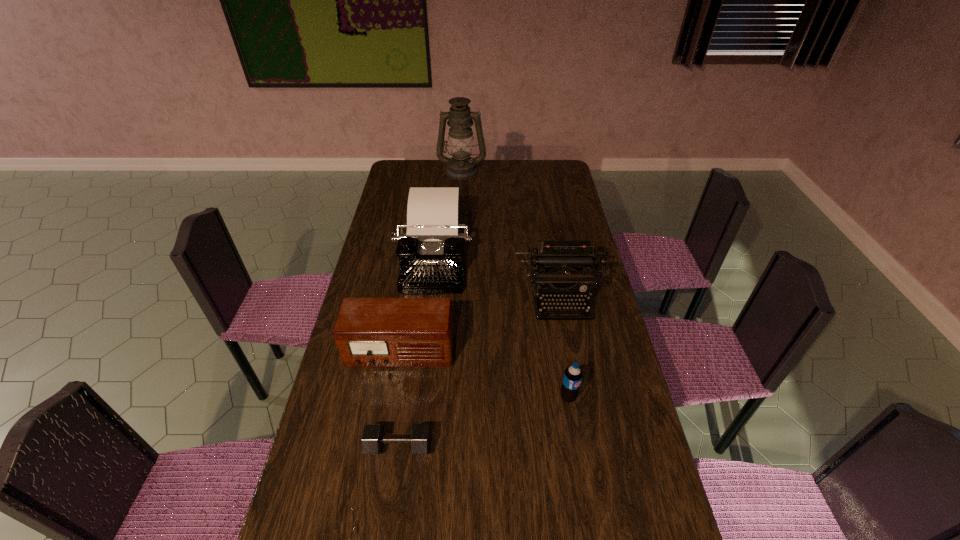
Choose which object is the third nearest neighbor to the farthest object. Please provide its 2D coordinates. Your answer should be formatted as a tuple, i.e. [(x, y)], where the tuple contains the x and y coordinates of a point satisfying the conditions above.

[(369, 332)]

You are a GUI agent. You are given a task and a screenshot of the screen. Output one action in this format:
    pyautogui.click(x=<x>, y=<y>)
    Task: Click on the object that stands as the fifth closest to the right typewriter
    
    Given the screenshot: What is the action you would take?
    pyautogui.click(x=461, y=166)

The width and height of the screenshot is (960, 540). Identify the location of free location that satisfies the following two spatial constraints: 1. on the front-facing side of the radio receiver; 2. on the right side of the nearest object. (385, 446).

Find the location of a particular element. free space that satisfies the following two spatial constraints: 1. on the front-facing side of the radio receiver; 2. on the left side of the dumbbell is located at coordinates (385, 446).